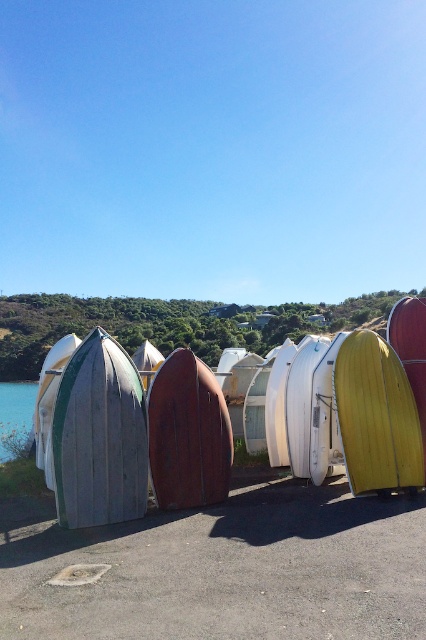
You are a delivery person who needs to place a package between the wooden surfboard at left and the rusty wood surfboard at center. The package requires 50 centimeters of space. Can you fit it there?

The wooden surfboard at left is 53.98 centimeters away from the rusty wood surfboard at center, which is more than enough space to fit the package requiring 50 centimeters.

You are a delivery person needing to carry both the wooden surfboard at left and the rusty wood surfboard at center. Given that your truck has a 1.5 meter width limit, can you fit both side by side?

The wooden surfboard at left is bigger than the rusty wood surfboard at center. However, without specific measurements, it is impossible to determine if both can fit within the 1.5 meter width limit. Additional information about their individual dimensions is required.